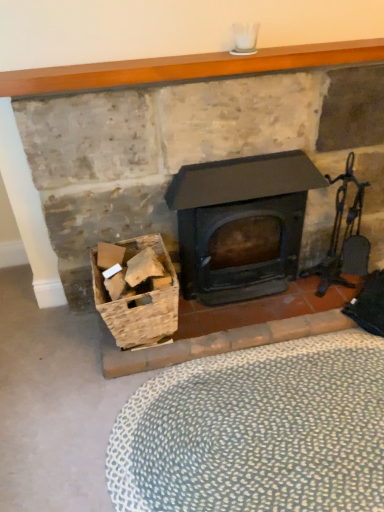
What are the coordinates of `vacant area to the left of metallic dark brown fireplace tool set at right` in the screenshot? It's located at (297, 308).